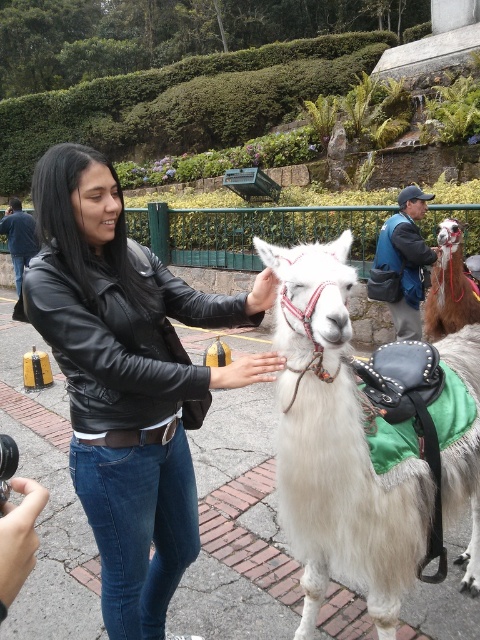
Question: Among these objects, which one is nearest to the camera?

Choices:
 (A) matte black hand at upper center
 (B) white woolen alpaca at center
 (C) white woolen camel at center
 (D) smooth skin hand at center

Answer: (C)

Question: Where is smooth skin hand at center located in relation to black leather jacket at upper left in the image?

Choices:
 (A) above
 (B) below

Answer: (B)

Question: Which point appears farthest from the camera in this image?

Choices:
 (A) (408, 310)
 (B) (129, 291)
 (C) (29, 248)

Answer: (C)

Question: Does white woolen camel at center have a greater width compared to matte black hand at upper center?

Choices:
 (A) no
 (B) yes

Answer: (B)

Question: Estimate the real-world distances between objects in this image. Which object is farther from the matte black hand at upper center?

Choices:
 (A) black leather jacket at upper left
 (B) smooth skin hand at center
 (C) white woolen alpaca at center

Answer: (A)

Question: Can you confirm if black leather jacket at upper left is positioned above matte black hand at upper center?

Choices:
 (A) no
 (B) yes

Answer: (B)